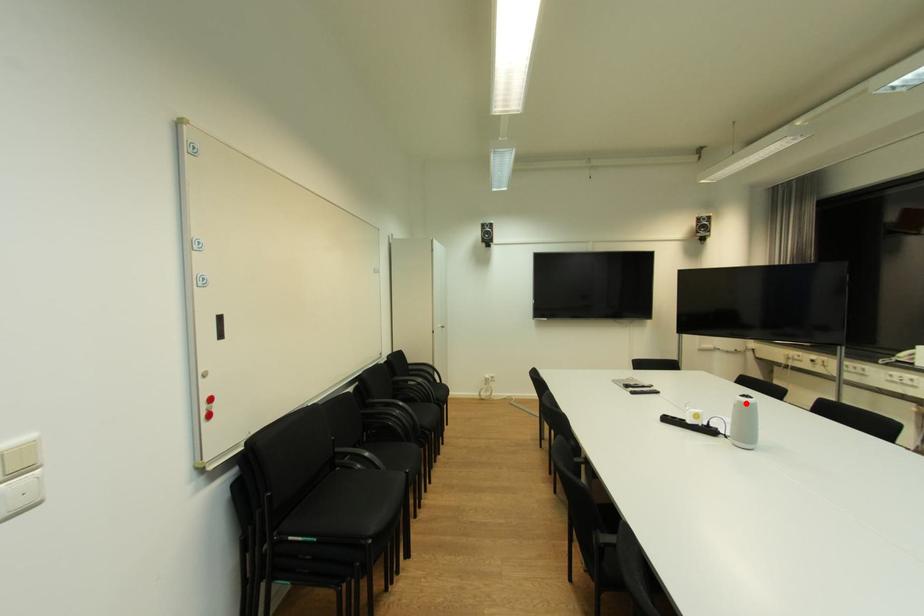
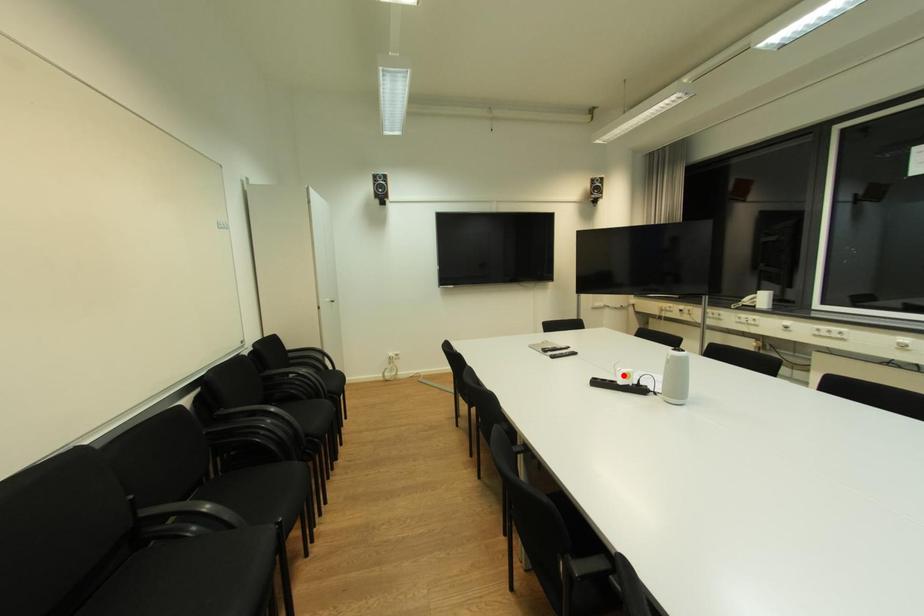
I am providing you with two images of the same scene from different viewpoints. A red point is marked on the first image and another point is marked on the second image. Do the highlighted points in image1 and image2 indicate the same real-world spot?

No